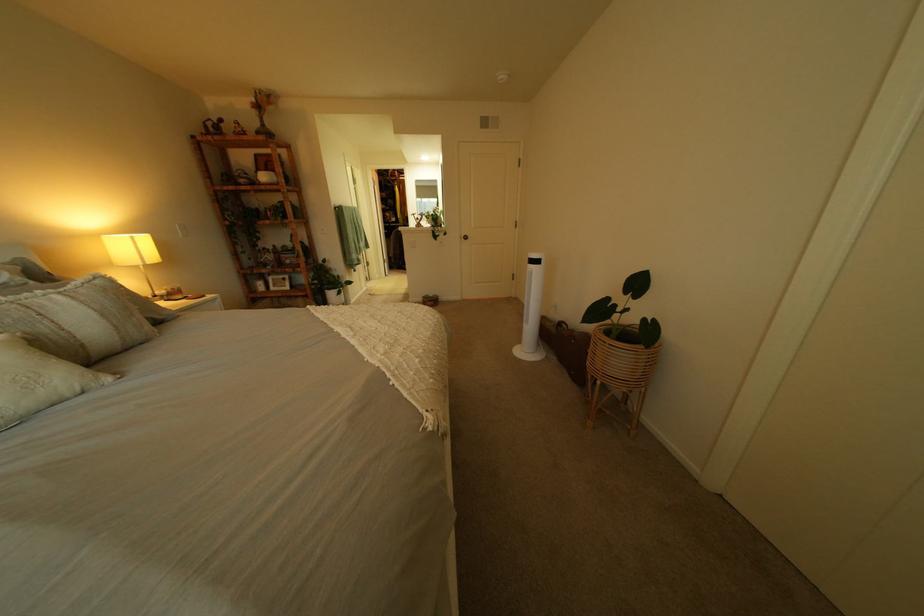
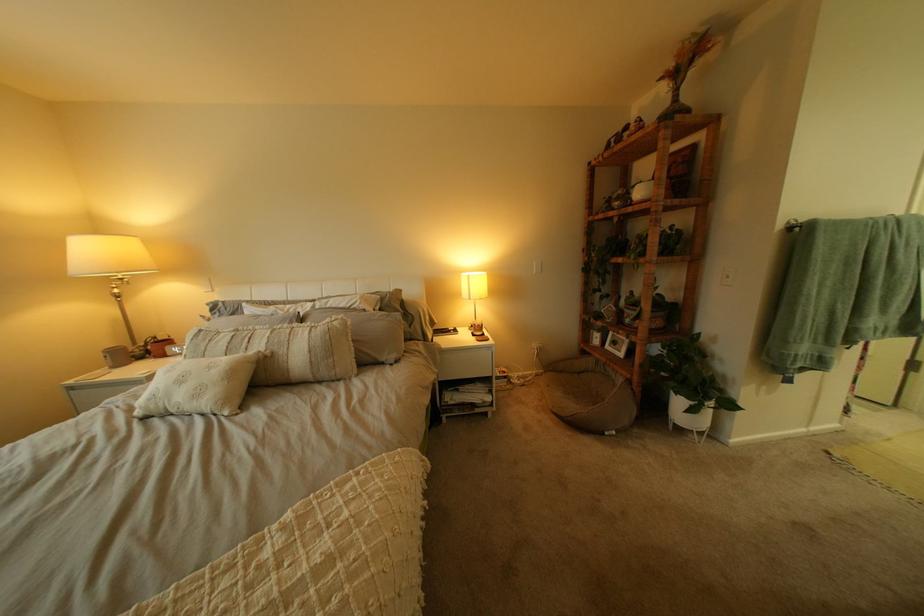
In the second image, find the point that corresponds to [268,108] in the first image.

(675, 81)